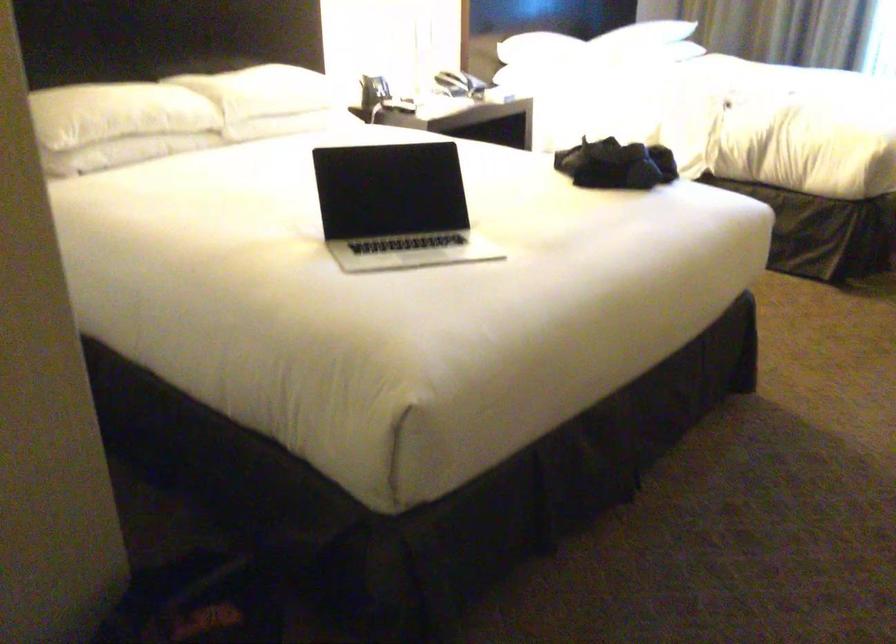
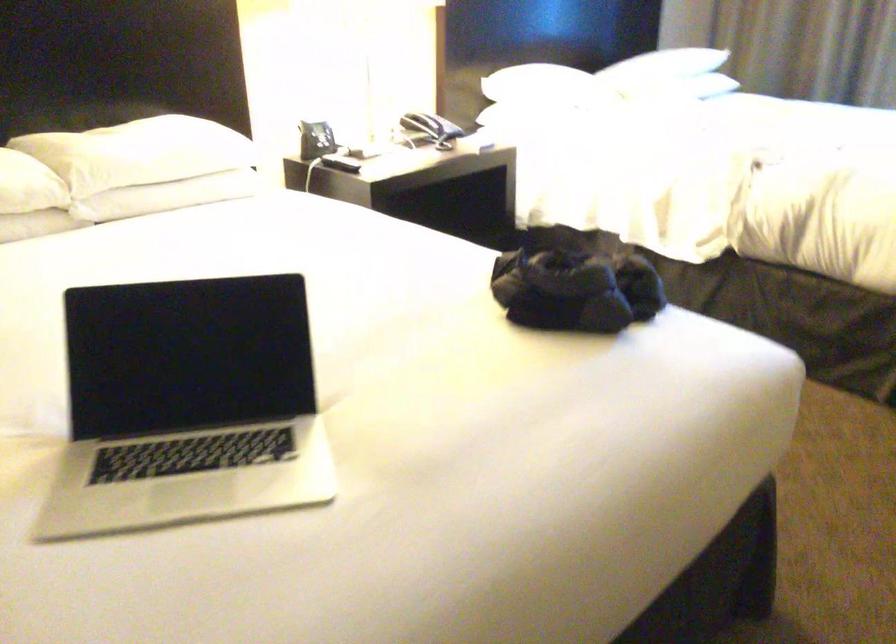
In the second image, find the point that corresponds to point (288, 120) in the first image.

(167, 196)